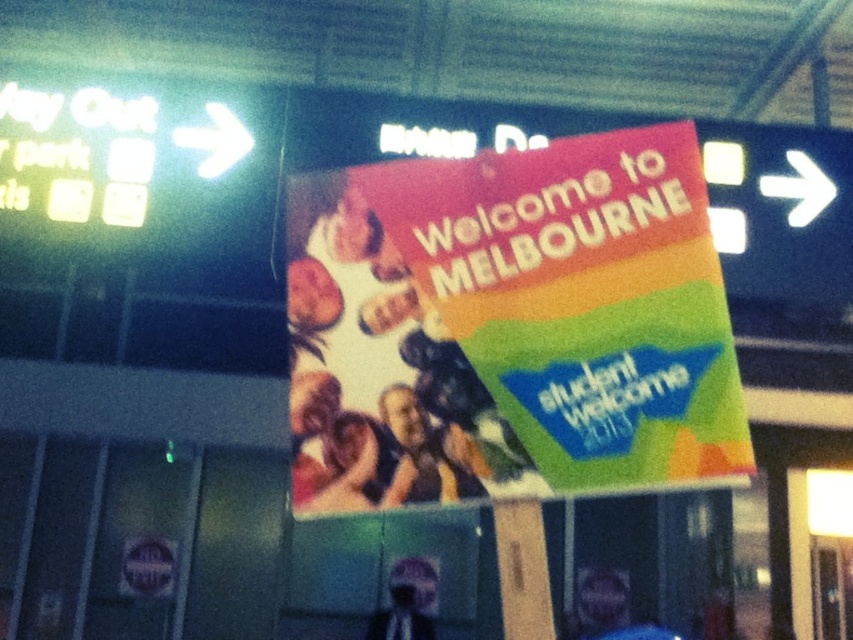
Is the position of matte plastic poster at center less distant than that of silvery metallic helmet at center?

Yes.

Who is positioned more to the right, matte plastic poster at center or silvery metallic helmet at center?

matte plastic poster at center

Identify the location of matte plastic poster at center. This screenshot has height=640, width=853. (509, 324).